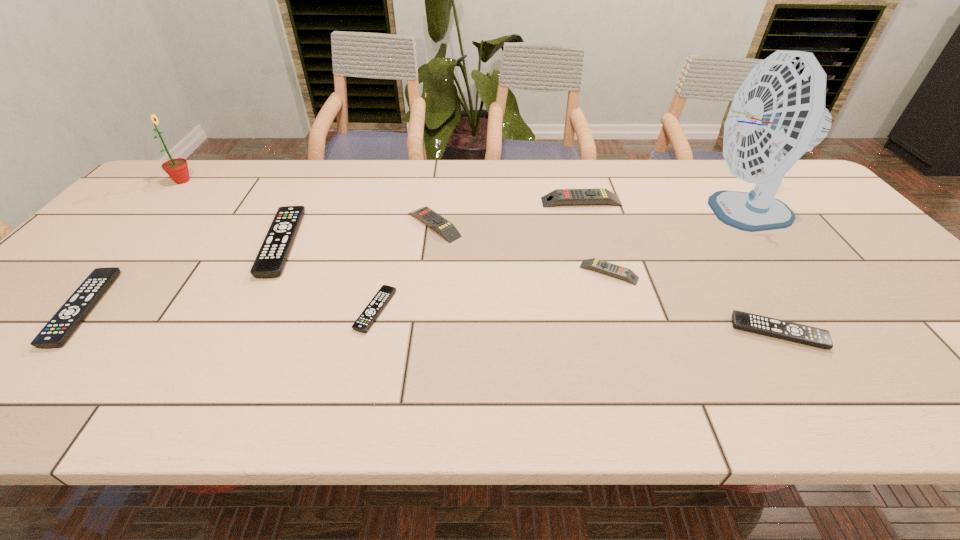
Image resolution: width=960 pixels, height=540 pixels. Identify the location of the leftmost black remote control. (62, 325).

Locate an element on the screen. The image size is (960, 540). the smallest yellow remote control is located at coordinates (617, 271).

Where is `the rightmost remote control`? the rightmost remote control is located at coordinates (804, 334).

Image resolution: width=960 pixels, height=540 pixels. In order to click on the second smallest black remote control in this screenshot , I will do `click(804, 334)`.

Where is `the second black remote control from right to left`? This screenshot has width=960, height=540. the second black remote control from right to left is located at coordinates (379, 301).

This screenshot has width=960, height=540. I want to click on the shortest object, so click(x=379, y=301).

Where is `vacant space situated on the grille of the tallest object`? vacant space situated on the grille of the tallest object is located at coordinates coord(663,211).

In order to click on free location located on the grille of the tallest object in this screenshot , I will do `click(654, 211)`.

This screenshot has height=540, width=960. Identify the location of free region located 0.170m on the grille of the tallest object. (626, 211).

You are a GUI agent. You are given a task and a screenshot of the screen. Output one action in this format:
    pyautogui.click(x=<x>, y=<y>)
    Task: Click on the vacant region located on the face of the sunflower
    
    Given the screenshot: What is the action you would take?
    pyautogui.click(x=262, y=181)